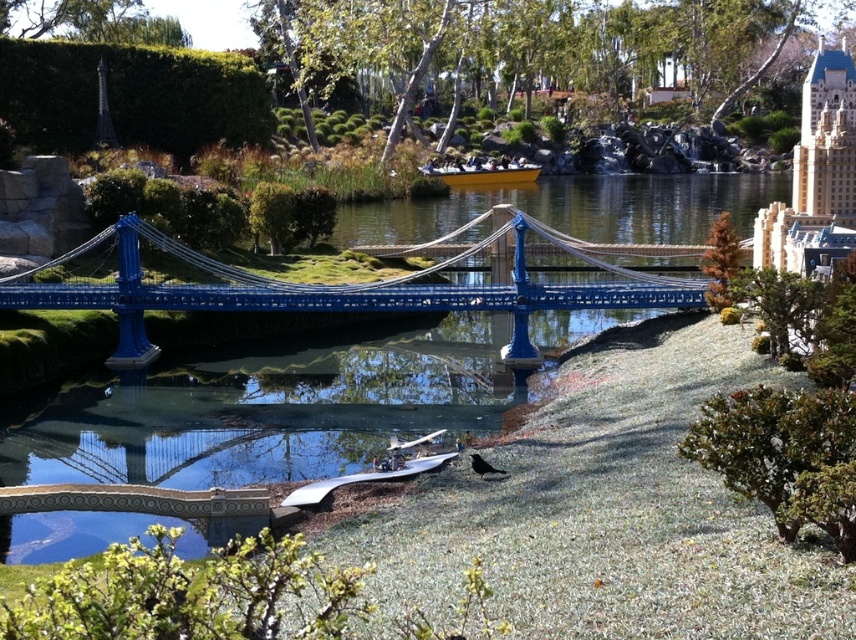
Question: Which object is closer to the camera taking this photo?

Choices:
 (A) yellow matte boat at center
 (B) metallic blue bridge at center

Answer: (B)

Question: Is metallic blue bridge at center below yellow matte boat at center?

Choices:
 (A) yes
 (B) no

Answer: (A)

Question: Can you confirm if metallic blue bridge at center is positioned above yellow matte boat at center?

Choices:
 (A) no
 (B) yes

Answer: (A)

Question: Can you confirm if metallic blue bridge at center is thinner than yellow matte boat at center?

Choices:
 (A) no
 (B) yes

Answer: (A)

Question: Among these points, which one is nearest to the camera?

Choices:
 (A) (479, 164)
 (B) (535, 356)

Answer: (B)